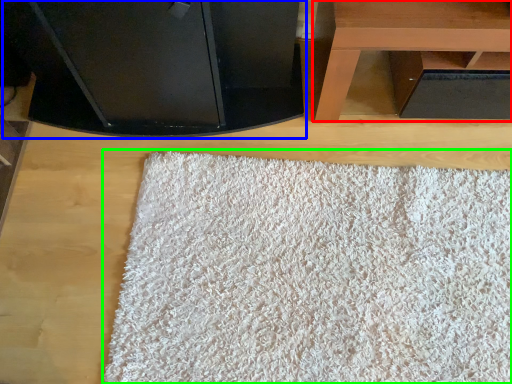
Question: Based on their relative distances, which object is nearer to table (highlighted by a red box)? Choose from furniture (highlighted by a blue box) and mat (highlighted by a green box).

Choices:
 (A) furniture
 (B) mat

Answer: (A)